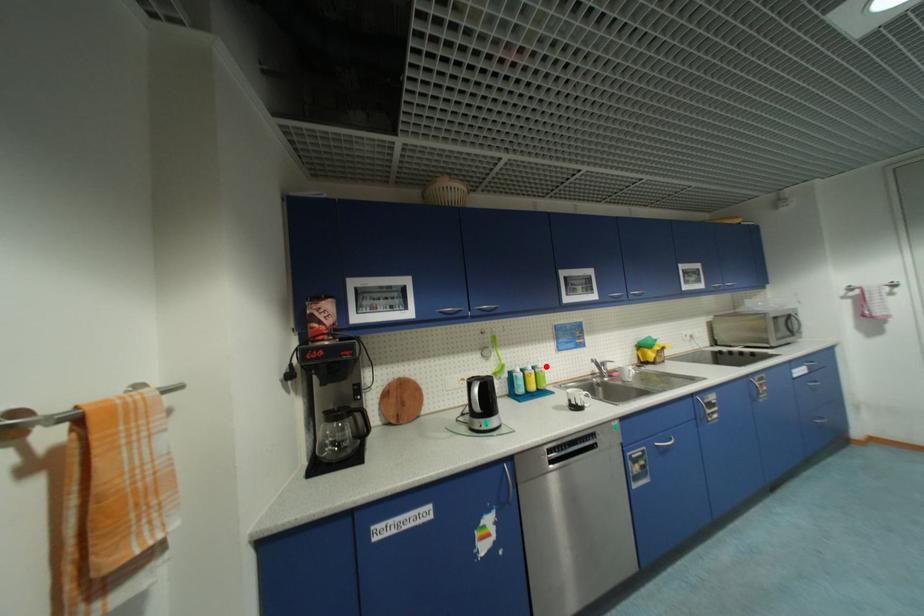
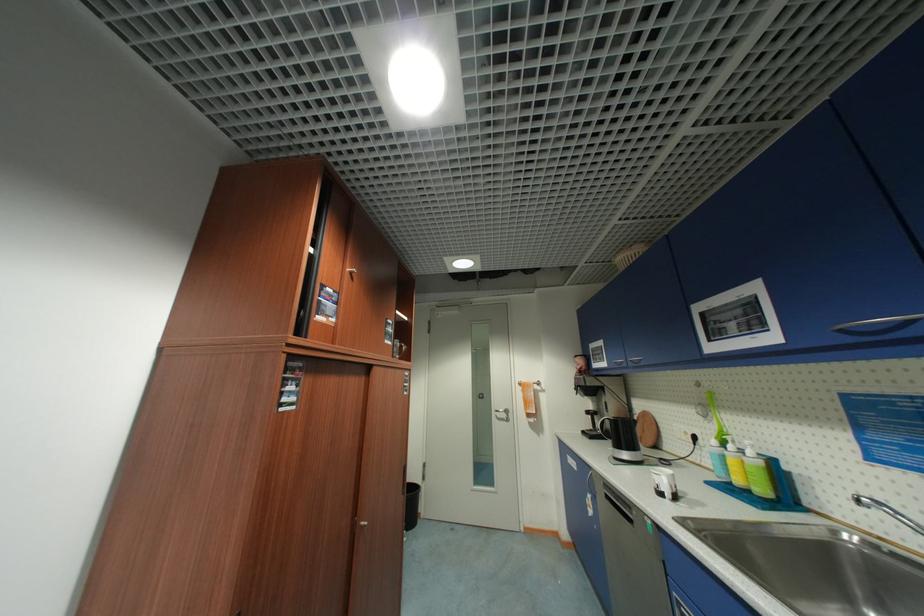
Question: I am providing you with two images of the same scene from different viewpoints. In image1, a red point is highlighted. Considering the same 3D point in image2, which of the following is correct?

Choices:
 (A) It is closer
 (B) It is farther

Answer: (A)